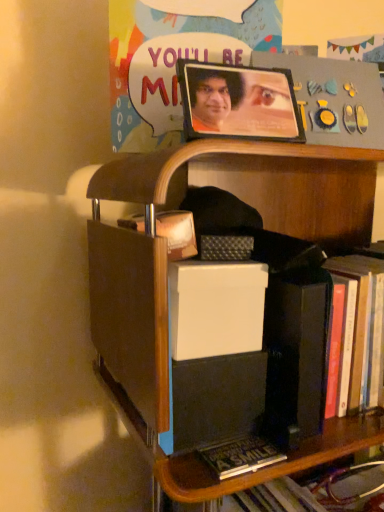
Question: Relative to wooden shelf at center, is wooden picture frame at upper center in front or behind?

Choices:
 (A) behind
 (B) front

Answer: (A)

Question: From a real-world perspective, relative to wooden shelf at center, is wooden picture frame at upper center vertically above or below?

Choices:
 (A) below
 (B) above

Answer: (B)

Question: Which object is positioned farthest from the matte plastic poster at upper center?

Choices:
 (A) wooden shelf at center
 (B) wooden picture frame at upper center

Answer: (A)

Question: Estimate the real-world distances between objects in this image. Which object is farther from the wooden picture frame at upper center?

Choices:
 (A) matte plastic poster at upper center
 (B) wooden shelf at center

Answer: (B)